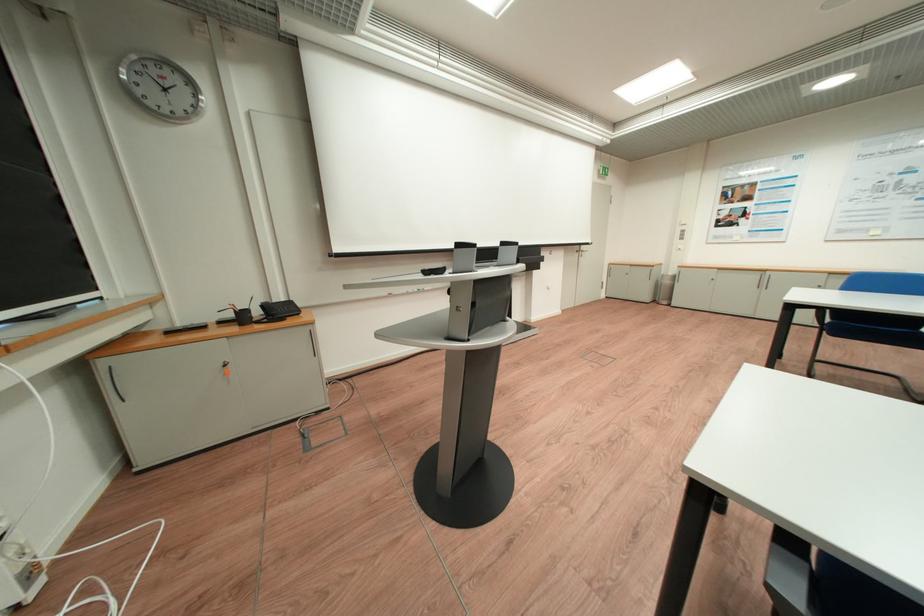
Image resolution: width=924 pixels, height=616 pixels. What are the coordinates of `metal trash can` in the screenshot? It's located at (665, 288).